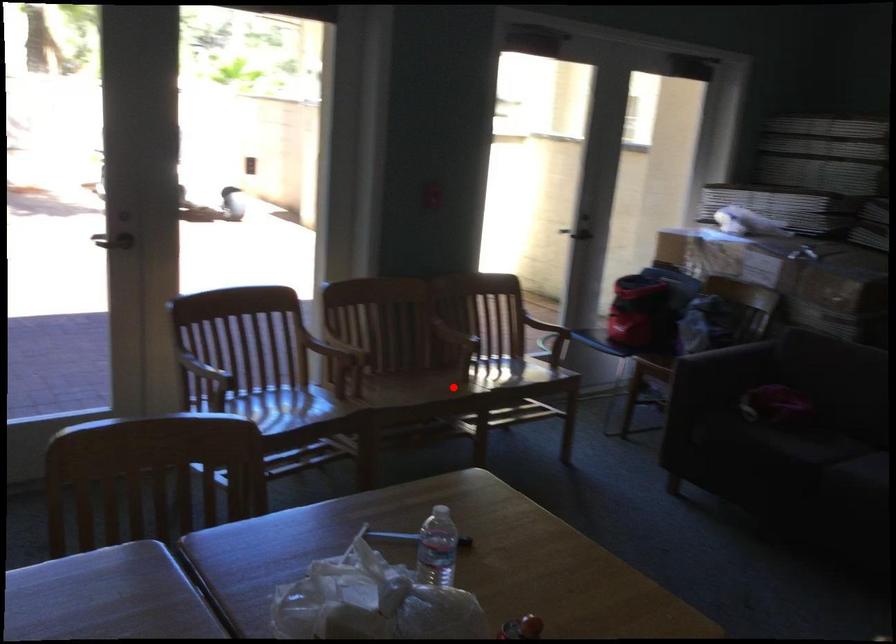
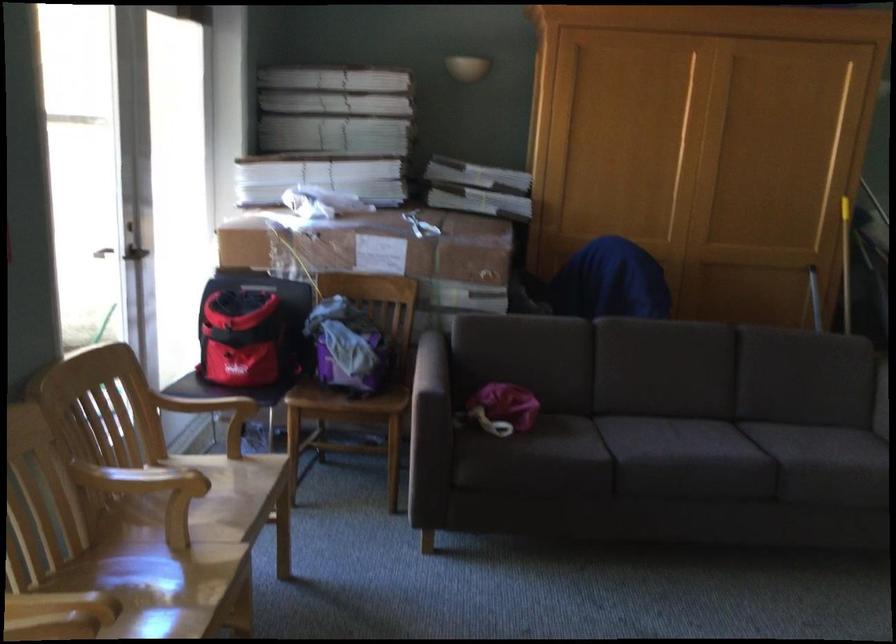
Question: I am providing you with two images of the same scene from different viewpoints. Image1 has a red point marked. In image2, the corresponding 3D location appears at what relative position? Reply with the corresponding letter.

Choices:
 (A) Closer
 (B) Farther

Answer: (A)